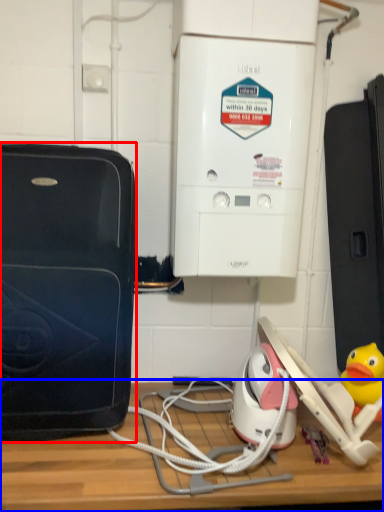
Question: Which object is closer to the camera taking this photo, home appliance (highlighted by a red box) or table (highlighted by a blue box)?

Choices:
 (A) home appliance
 (B) table

Answer: (B)